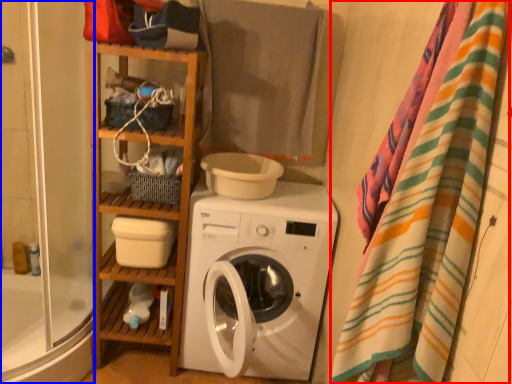
Question: Which object is closer to the camera taking this photo, blanket (highlighted by a red box) or shower door (highlighted by a blue box)?

Choices:
 (A) blanket
 (B) shower door

Answer: (A)